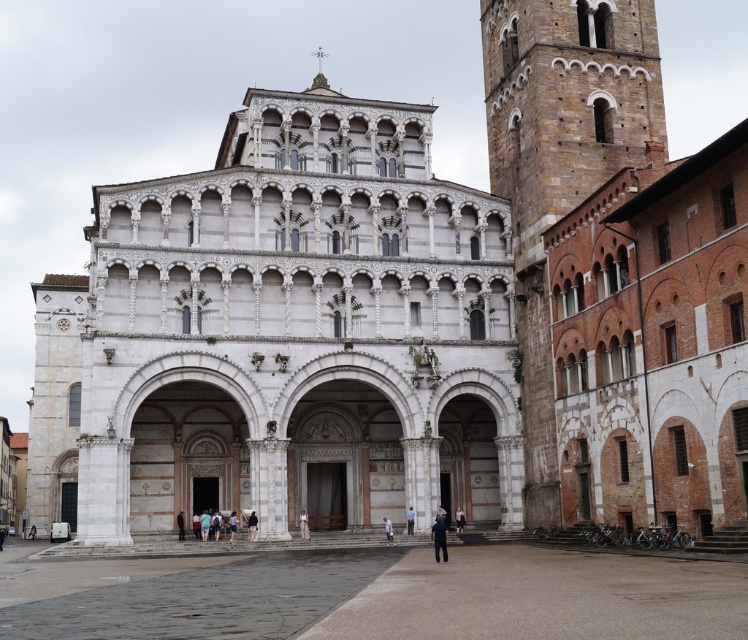
Between light beige fabric at center and light blue fabric at center, which one is positioned lower?

light beige fabric at center is lower down.

Is the position of light beige fabric at center less distant than that of light blue fabric at center?

No, light beige fabric at center is behind light blue fabric at center.

At what (x,y) coordinates should I click in order to perform the action: click on light beige fabric at center. Please return your answer as a coordinate pair (x, y). The height and width of the screenshot is (640, 748). Looking at the image, I should click on (303, 524).

Is dark blue jeans at center thinner than dark brown leather jacket at lower center?

Yes.

Does dark blue jeans at center have a greater height compared to dark brown leather jacket at lower center?

In fact, dark blue jeans at center may be shorter than dark brown leather jacket at lower center.

Between point (456, 518) and point (183, 516), which one is positioned in front?

Point (183, 516) is more forward.

Find the location of `dark blue jeans at center`. dark blue jeans at center is located at coordinates (459, 518).

The height and width of the screenshot is (640, 748). Find the location of `dark brown leather jacket at lower center`. dark brown leather jacket at lower center is located at coordinates (180, 524).

Between point (177, 524) and point (411, 524), which one is positioned behind?

Point (411, 524)

At what (x,y) coordinates should I click in order to perform the action: click on dark brown leather jacket at lower center. Please return your answer as a coordinate pair (x, y). The width and height of the screenshot is (748, 640). Looking at the image, I should click on (180, 524).